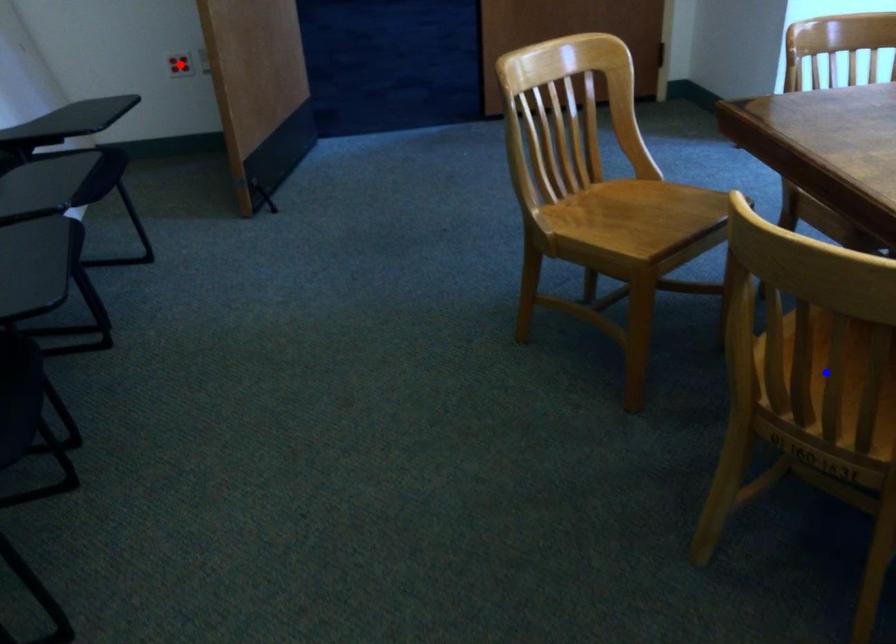
Question: Two points are marked on the image. Which point is closer to the camera?

Choices:
 (A) Blue point is closer.
 (B) Red point is closer.

Answer: (A)